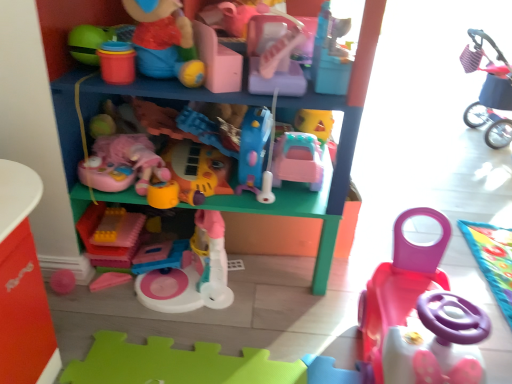
Question: In which direction should I rotate to look at translucent yellow plastic blocks at center, placed as the eighth toy when sorted from right to left?

Choices:
 (A) right
 (B) left

Answer: (B)

Question: Does pink plastic car at center, the 4th toy from the right, have a larger size compared to plush pink stroller at upper right, which ranks as the first toy in right-to-left order?

Choices:
 (A) yes
 (B) no

Answer: (B)

Question: From the image's perspective, is pink plastic car at center, arranged as the 5th toy when viewed from the left, above plush pink stroller at upper right, which ranks as the first toy in right-to-left order?

Choices:
 (A) yes
 (B) no

Answer: (B)

Question: Is pink plastic car at center, the 4th toy from the right, oriented away from plush pink stroller at upper right, which ranks as the 8th toy in left-to-right order?

Choices:
 (A) no
 (B) yes

Answer: (A)

Question: Is the depth of pink plastic car at center, the 4th toy from the right, greater than that of plush pink stroller at upper right, which ranks as the 8th toy in left-to-right order?

Choices:
 (A) yes
 (B) no

Answer: (B)

Question: Could you tell me if pink plastic car at center, arranged as the 5th toy when viewed from the left, is turned towards plush pink stroller at upper right, which ranks as the first toy in right-to-left order?

Choices:
 (A) yes
 (B) no

Answer: (B)

Question: Does pink plastic car at center, arranged as the 5th toy when viewed from the left, contain plush pink stroller at upper right, which ranks as the 8th toy in left-to-right order?

Choices:
 (A) yes
 (B) no

Answer: (B)

Question: From the image's perspective, is pink plastic toy at center, the 7th toy in the right-to-left sequence, located beneath pink plastic toy car at lower right, the seventh toy positioned from the left?

Choices:
 (A) no
 (B) yes

Answer: (A)

Question: Is pink plastic toy at center, marked as the 2th toy in a left-to-right arrangement, positioned in front of pink plastic toy car at lower right, the seventh toy positioned from the left?

Choices:
 (A) no
 (B) yes

Answer: (A)

Question: Does pink plastic toy at center, marked as the 2th toy in a left-to-right arrangement, touch pink plastic toy car at lower right, marked as the 2th toy in a right-to-left arrangement?

Choices:
 (A) yes
 (B) no

Answer: (B)

Question: Considering the relative sizes of pink plastic toy at center, the 7th toy in the right-to-left sequence, and pink plastic toy car at lower right, the seventh toy positioned from the left, in the image provided, is pink plastic toy at center, the 7th toy in the right-to-left sequence, taller than pink plastic toy car at lower right, the seventh toy positioned from the left,?

Choices:
 (A) yes
 (B) no

Answer: (B)

Question: From a real-world perspective, is pink plastic toy at center, the 7th toy in the right-to-left sequence, below pink plastic toy car at lower right, marked as the 2th toy in a right-to-left arrangement?

Choices:
 (A) yes
 (B) no

Answer: (A)

Question: Considering the relative sizes of pink plastic toy at center, marked as the 2th toy in a left-to-right arrangement, and pink plastic toy car at lower right, marked as the 2th toy in a right-to-left arrangement, in the image provided, is pink plastic toy at center, marked as the 2th toy in a left-to-right arrangement, wider than pink plastic toy car at lower right, marked as the 2th toy in a right-to-left arrangement,?

Choices:
 (A) no
 (B) yes

Answer: (B)

Question: Is plush pink stroller at upper right, which ranks as the 8th toy in left-to-right order, positioned beyond the bounds of pink plastic car at center, the 4th toy from the right?

Choices:
 (A) yes
 (B) no

Answer: (A)